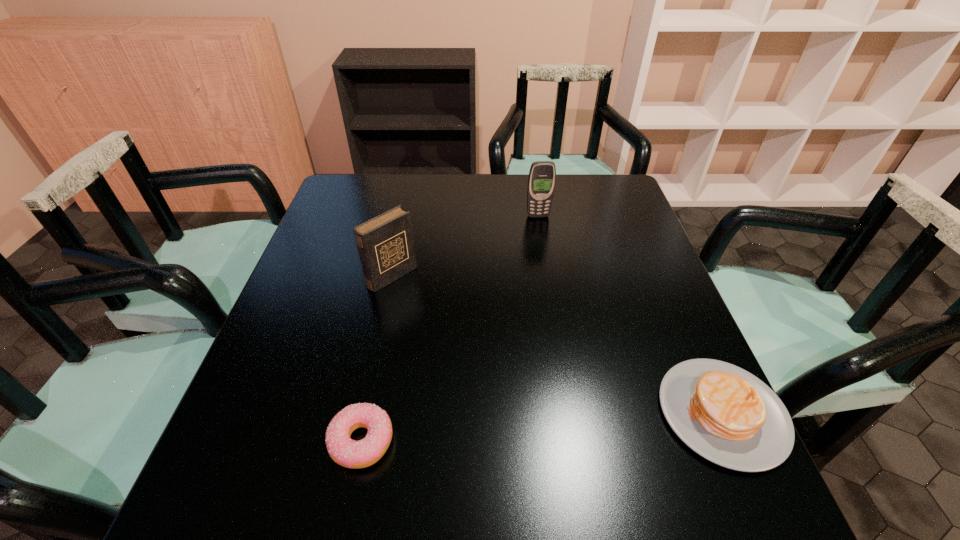
At what (x,y) coordinates should I click in order to perform the action: click on free space that satisfies the following two spatial constraints: 1. on the front side of the third nearest object; 2. on the left side of the shortest object. Please return your answer as a coordinate pair (x, y). Image resolution: width=960 pixels, height=540 pixels. Looking at the image, I should click on (357, 441).

The width and height of the screenshot is (960, 540). I want to click on vacant space that satisfies the following two spatial constraints: 1. on the back side of the farthest object; 2. on the left side of the third nearest object, so click(x=405, y=216).